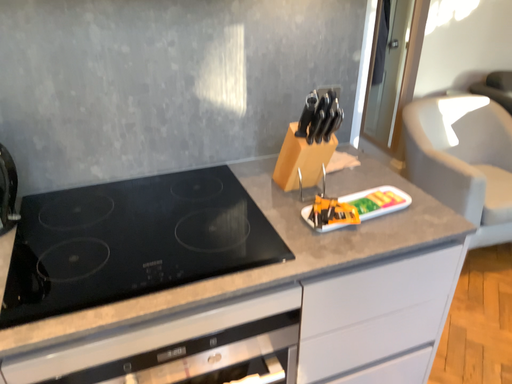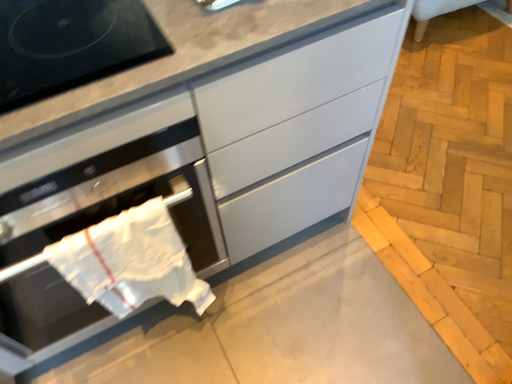
Question: How did the camera likely rotate when shooting the video?

Choices:
 (A) rotated upward
 (B) rotated downward

Answer: (B)